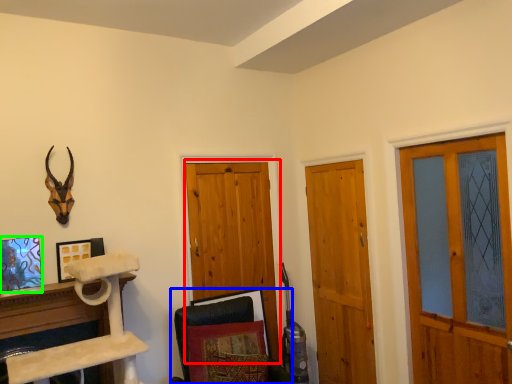
Question: Which object is the farthest from barn door (highlighted by a red box)? Choose among these: swivel chair (highlighted by a blue box) or picture frame (highlighted by a green box).

Choices:
 (A) swivel chair
 (B) picture frame

Answer: (B)